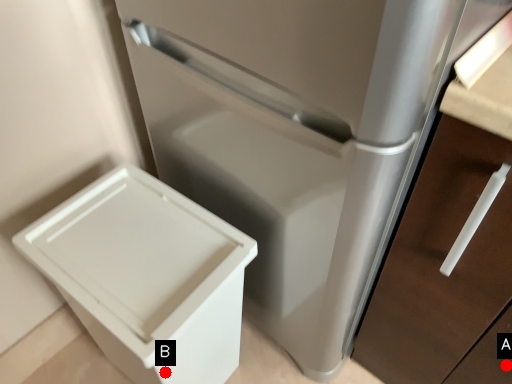
Question: Two points are circled on the image, labeled by A and B beside each circle. Which of the following is the farthest from the observer?

Choices:
 (A) A is further
 (B) B is further

Answer: (B)